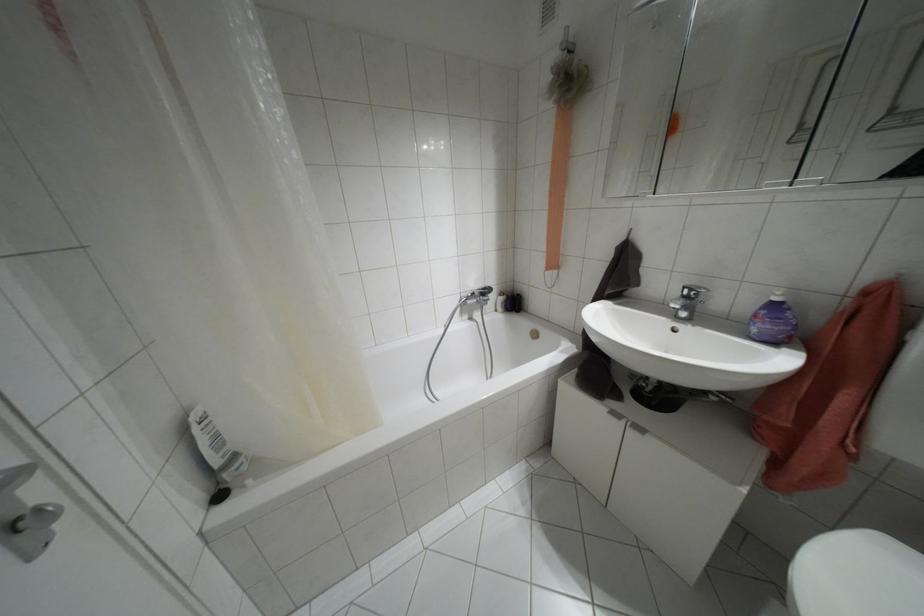
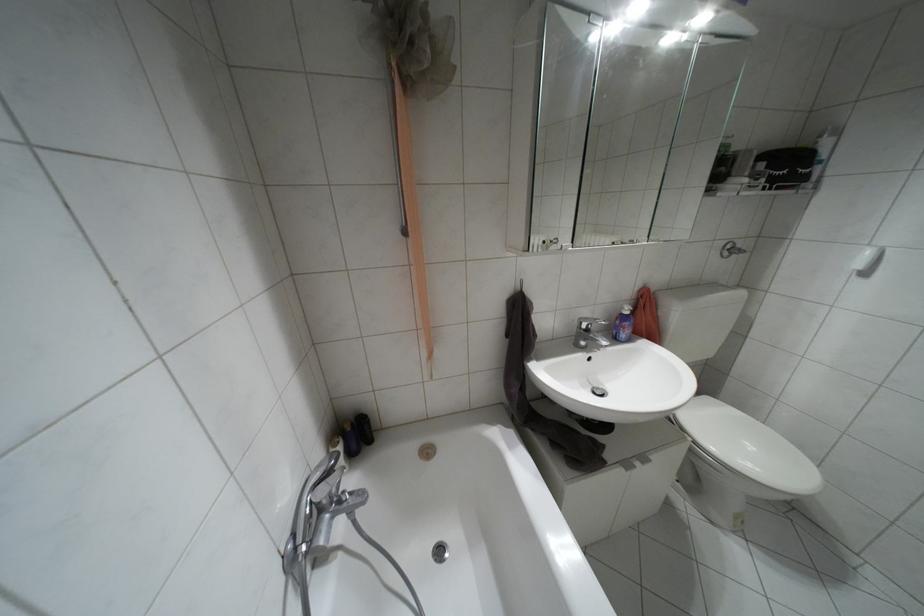
Locate, in the second image, the point that corresponds to (x=774, y=299) in the first image.

(626, 312)